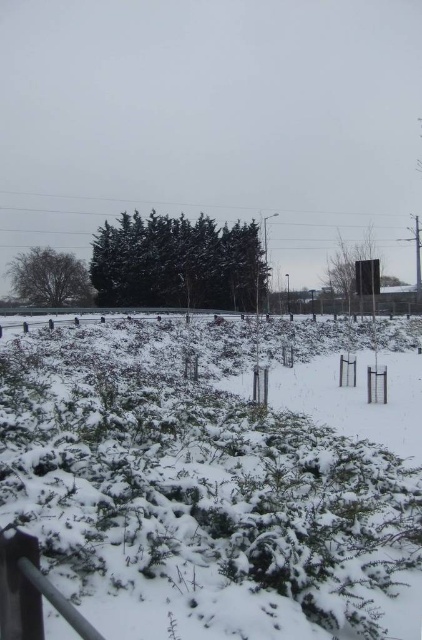
Where is `white fluffy snow at center`? Image resolution: width=422 pixels, height=640 pixels. white fluffy snow at center is located at coordinates (195, 480).

At what (x,y) coordinates should I click in order to perform the action: click on white fluffy snow at center. Please return your answer as a coordinate pair (x, y). The height and width of the screenshot is (640, 422). Looking at the image, I should click on (195, 480).

Does point (130, 234) come in front of point (53, 262)?

Yes.

Is point (200, 289) positioned after point (91, 285)?

No, it is not.

The image size is (422, 640). I want to click on snow-covered evergreen tree at center, so tap(178, 262).

At what (x,y) coordinates should I click in order to perform the action: click on snow-covered evergreen tree at center. Please return your answer as a coordinate pair (x, y). The image size is (422, 640). Looking at the image, I should click on point(178,262).

Is point (292, 554) more distant than point (172, 296)?

No, it is in front of (172, 296).

Looking at this image, is white fluffy snow at center bigger than snow-covered evergreen tree at center?

Incorrect, white fluffy snow at center is not larger than snow-covered evergreen tree at center.

Identify the location of white fluffy snow at center. (195, 480).